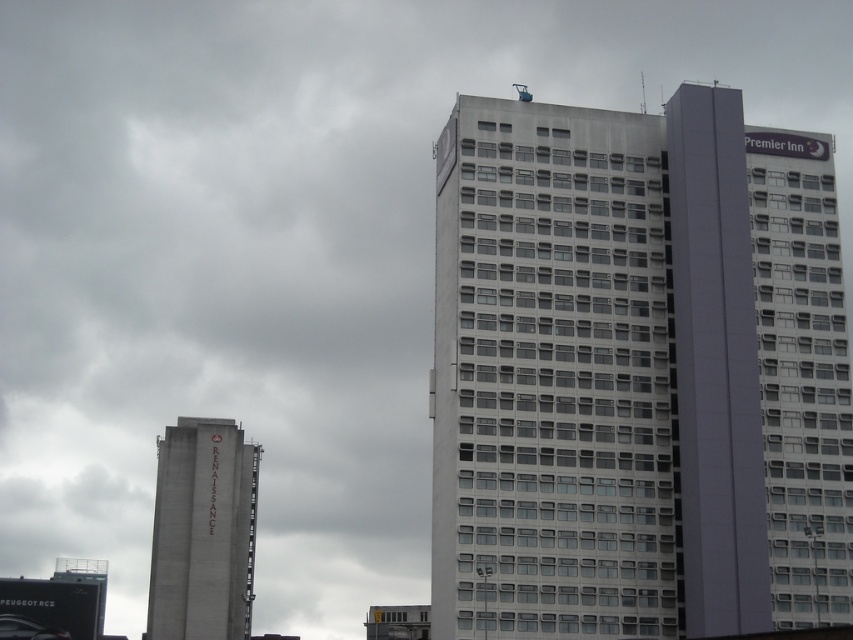
You are a drone operator planning to fly a drone between the white glass building at center and the concrete tower at left. According to the scene description, which building should the drone approach first to navigate between them?

The white glass building at center is positioned on the right side of concrete tower at left, so the drone should approach the concrete tower at left first before navigating towards the white glass building at center.

In the scene shown: You are an architect reviewing a city plan. You notice the white glass building at center and the concrete tower at left. Which one is positioned higher in the image?

The white glass building at center is positioned higher in the image than the concrete tower at left according to the description.